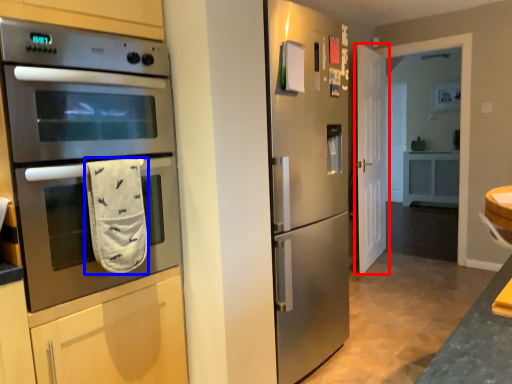
Question: Which point is closer to the camera, door (highlighted by a red box) or hand towel (highlighted by a blue box)?

Choices:
 (A) door
 (B) hand towel

Answer: (B)